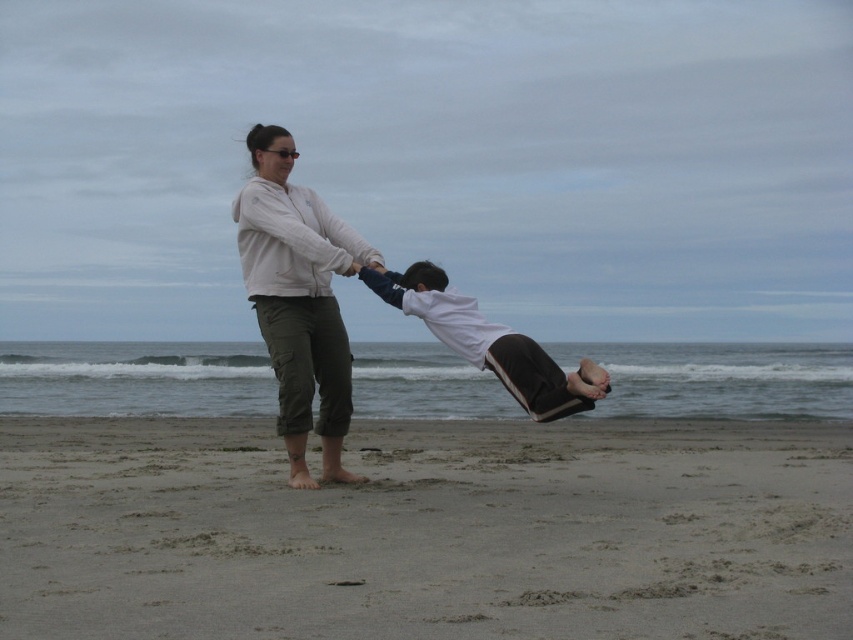
Can you confirm if light pink fleece jacket at center is positioned below white cotton shirt at center?

Actually, light pink fleece jacket at center is above white cotton shirt at center.

At what (x,y) coordinates should I click in order to perform the action: click on light pink fleece jacket at center. Please return your answer as a coordinate pair (x, y). Looking at the image, I should click on (299, 298).

Does brown sandy beach at center appear on the left side of light pink fleece jacket at center?

No, brown sandy beach at center is not to the left of light pink fleece jacket at center.

Is brown sandy beach at center wider than light pink fleece jacket at center?

Correct, the width of brown sandy beach at center exceeds that of light pink fleece jacket at center.

At what (x,y) coordinates should I click in order to perform the action: click on brown sandy beach at center. Please return your answer as a coordinate pair (x, y). Looking at the image, I should click on (426, 531).

Identify the location of brown sandy beach at center. (426, 531).

Who is higher up, brown sandy beach at center or white cotton shirt at center?

Positioned higher is white cotton shirt at center.

In order to click on brown sandy beach at center in this screenshot , I will do `click(426, 531)`.